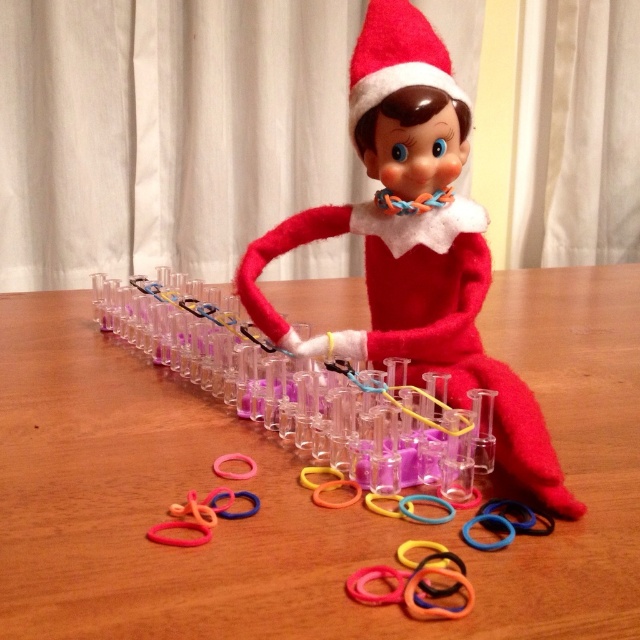
You are a visitor at a Christmas craft workshop and see the wooden table at center and the rubber band at lower center. Which object is positioned higher from the ground?

The wooden table at center is positioned higher from the ground than the rubber band at lower center because it is above it.

You are standing in front of the scene and want to reach out to touch the point at coordinates point (x=296, y=618). If your hand can reach up to 35 centimeters, will you be able to touch it?

The distance of point (x=296, y=618) from viewer is 34.90 centimeters, so yes, your hand can reach it since it is within the 35 centimeter limit.

Looking at the craft setup, which rubber band is closer to the table surface between the rubber band at center and the rubber band at lower center?

The rubber band at lower center is closer to the table surface because it has a lesser height compared to the rubber band at center.